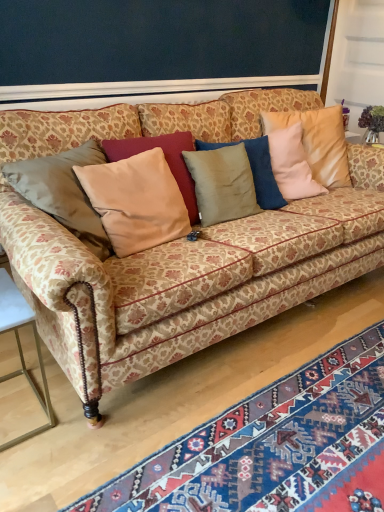
Question: Which is correct: satin beige pillow at center, which is the second pillow in left-to-right order, is inside blue woven rug at lower right, or outside of it?

Choices:
 (A) outside
 (B) inside

Answer: (A)

Question: Is satin beige pillow at center, arranged as the 1th pillow when viewed from the right, wider or thinner than blue woven rug at lower right?

Choices:
 (A) thin
 (B) wide

Answer: (A)

Question: Which object is the farthest from the satin beige pillow at center, arranged as the 1th pillow when viewed from the right?

Choices:
 (A) patterned fabric couch at center
 (B) gold metallic table at lower left
 (C) blue woven rug at lower right
 (D) beige velvet pillow at center, which ranks as the 1th pillow in left-to-right order

Answer: (B)

Question: Considering the real-world distances, which object is farthest from the beige velvet pillow at center, which ranks as the 1th pillow in left-to-right order?

Choices:
 (A) satin beige pillow at center, which is the second pillow in left-to-right order
 (B) patterned fabric couch at center
 (C) blue woven rug at lower right
 (D) gold metallic table at lower left

Answer: (C)